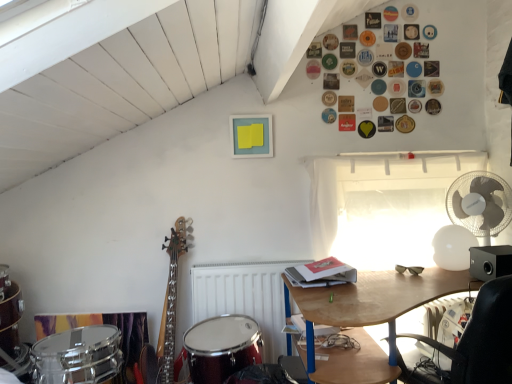
Question: Can you confirm if white sheer curtain at upper right is bigger than shiny red drum at lower left?

Choices:
 (A) no
 (B) yes

Answer: (A)

Question: From a real-world perspective, is white sheer curtain at upper right positioned over shiny red drum at lower left based on gravity?

Choices:
 (A) no
 (B) yes

Answer: (B)

Question: Does white sheer curtain at upper right lie behind shiny red drum at lower left?

Choices:
 (A) no
 (B) yes

Answer: (B)

Question: Is white sheer curtain at upper right thinner than shiny red drum at lower left?

Choices:
 (A) yes
 (B) no

Answer: (A)

Question: Does white sheer curtain at upper right appear on the left side of shiny red drum at lower left?

Choices:
 (A) no
 (B) yes

Answer: (A)

Question: In the image, is white sheer curtain at upper right on the left side or the right side of shiny red drum at lower left?

Choices:
 (A) left
 (B) right

Answer: (B)

Question: In terms of height, does white sheer curtain at upper right look taller or shorter compared to shiny red drum at lower left?

Choices:
 (A) short
 (B) tall

Answer: (B)

Question: Considering the positions of white sheer curtain at upper right and shiny red drum at lower left in the image, is white sheer curtain at upper right wider or thinner than shiny red drum at lower left?

Choices:
 (A) wide
 (B) thin

Answer: (B)

Question: Looking at the image, does white sheer curtain at upper right seem bigger or smaller compared to shiny red drum at lower left?

Choices:
 (A) big
 (B) small

Answer: (B)

Question: Visually, is white plastic fan at right positioned to the left or to the right of shiny red drum at lower left?

Choices:
 (A) right
 (B) left

Answer: (A)

Question: Is point (480, 223) closer or farther from the camera than point (219, 359)?

Choices:
 (A) closer
 (B) farther

Answer: (B)

Question: Is white plastic fan at right in front of or behind shiny red drum at lower left in the image?

Choices:
 (A) front
 (B) behind

Answer: (B)

Question: Which is correct: white plastic fan at right is inside shiny red drum at lower left, or outside of it?

Choices:
 (A) inside
 (B) outside

Answer: (B)

Question: Considering the positions of wooden desk at lower right and matte black sunglasses at center right in the image, is wooden desk at lower right wider or thinner than matte black sunglasses at center right?

Choices:
 (A) thin
 (B) wide

Answer: (B)

Question: Is point (365, 283) closer or farther from the camera than point (398, 264)?

Choices:
 (A) closer
 (B) farther

Answer: (A)